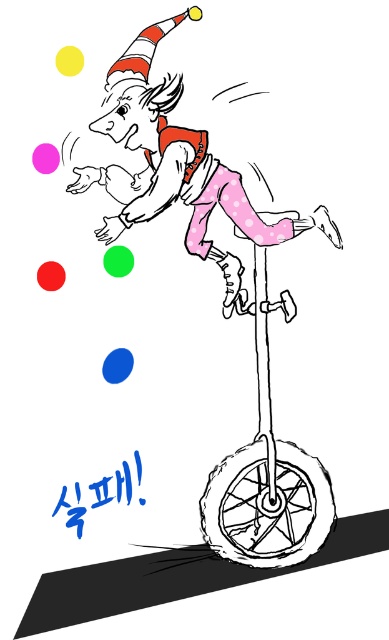
Identify the location of black rubber scooter at center. The height and width of the screenshot is (640, 389). pos(266,477).

Does point (320, 522) come closer to viewer compared to point (301, 525)?

No, it is not.

Is point (294, 464) closer to viewer compared to point (289, 506)?

No, (294, 464) is behind (289, 506).

Where is `black rubber scooter at center`? This screenshot has width=389, height=640. black rubber scooter at center is located at coordinates (266, 477).

Is point (238, 220) farther from camera compared to point (320, 502)?

No, (238, 220) is closer to viewer.

Which is in front, point (185, 170) or point (280, 456)?

Point (185, 170)

Between point (126, 141) and point (255, 481), which one is positioned in front?

Point (126, 141) is more forward.

You are a GUI agent. You are given a task and a screenshot of the screen. Output one action in this format:
    pyautogui.click(x=<x>, y=<y>)
    Task: Click on the pink dotted pants at center
    The image size is (389, 640).
    Given the screenshot: What is the action you would take?
    pyautogui.click(x=178, y=168)

Who is positioned more to the left, pink dotted pants at center or black rubber wheel at lower center?

From the viewer's perspective, pink dotted pants at center appears more on the left side.

How distant is pink dotted pants at center from black rubber wheel at lower center?

A distance of 13.50 inches exists between pink dotted pants at center and black rubber wheel at lower center.

Which is in front, point (162, 150) or point (238, 525)?

Positioned in front is point (162, 150).

At what (x,y) coordinates should I click in order to perform the action: click on pink dotted pants at center. Please return your answer as a coordinate pair (x, y). The width and height of the screenshot is (389, 640). Looking at the image, I should click on (178, 168).